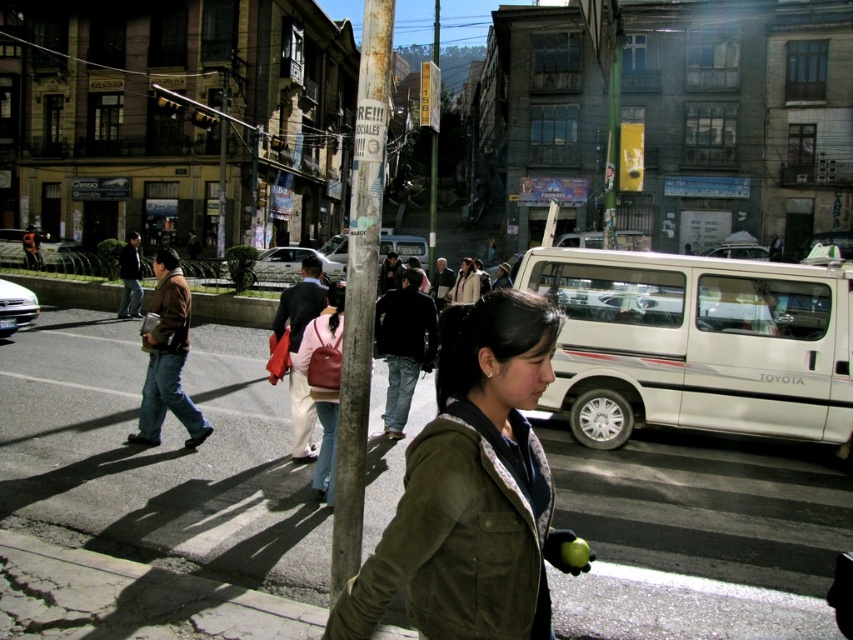
You are a delivery person trying to cross the street and see the brown leather jacket at left and the white glossy sedan at left. Which object is closer to the left side of the crosswalk?

The brown leather jacket at left is positioned on the left side of the white glossy sedan at left, so the brown leather jacket at left is closer to the left side of the crosswalk.